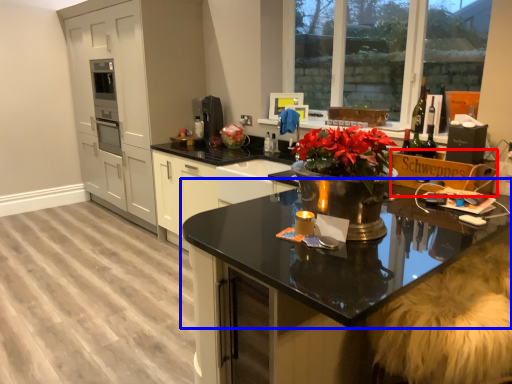
Question: Which object appears farthest to the camera in this image, cardboard box (highlighted by a red box) or countertop (highlighted by a blue box)?

Choices:
 (A) cardboard box
 (B) countertop

Answer: (A)